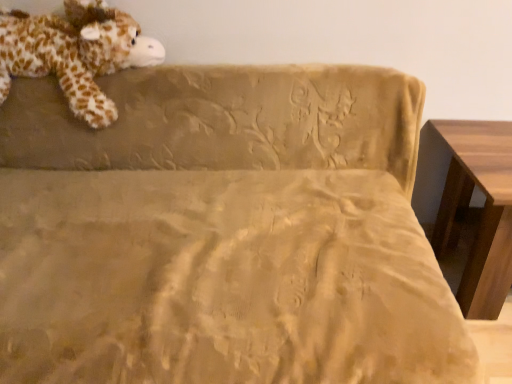
Question: Does wooden table at right contain soft plush giraffe at upper left?

Choices:
 (A) yes
 (B) no

Answer: (B)

Question: Is wooden table at right oriented away from soft plush giraffe at upper left?

Choices:
 (A) no
 (B) yes

Answer: (A)

Question: From a real-world perspective, is wooden table at right physically above soft plush giraffe at upper left?

Choices:
 (A) yes
 (B) no

Answer: (B)

Question: Is wooden table at right facing towards soft plush giraffe at upper left?

Choices:
 (A) no
 (B) yes

Answer: (A)

Question: Does wooden table at right have a lesser width compared to soft plush giraffe at upper left?

Choices:
 (A) yes
 (B) no

Answer: (B)

Question: Does wooden table at right have a larger size compared to soft plush giraffe at upper left?

Choices:
 (A) yes
 (B) no

Answer: (A)

Question: Is soft plush giraffe at upper left to the right of wooden table at right from the viewer's perspective?

Choices:
 (A) yes
 (B) no

Answer: (B)

Question: From a real-world perspective, is soft plush giraffe at upper left on wooden table at right?

Choices:
 (A) no
 (B) yes

Answer: (B)

Question: Would you say soft plush giraffe at upper left is a long distance from wooden table at right?

Choices:
 (A) yes
 (B) no

Answer: (A)

Question: Is soft plush giraffe at upper left bigger than wooden table at right?

Choices:
 (A) yes
 (B) no

Answer: (B)

Question: Is soft plush giraffe at upper left beside wooden table at right?

Choices:
 (A) no
 (B) yes

Answer: (A)

Question: From the image's perspective, is soft plush giraffe at upper left under wooden table at right?

Choices:
 (A) no
 (B) yes

Answer: (A)

Question: Considering the positions of soft plush giraffe at upper left and wooden table at right in the image, is soft plush giraffe at upper left bigger or smaller than wooden table at right?

Choices:
 (A) small
 (B) big

Answer: (A)